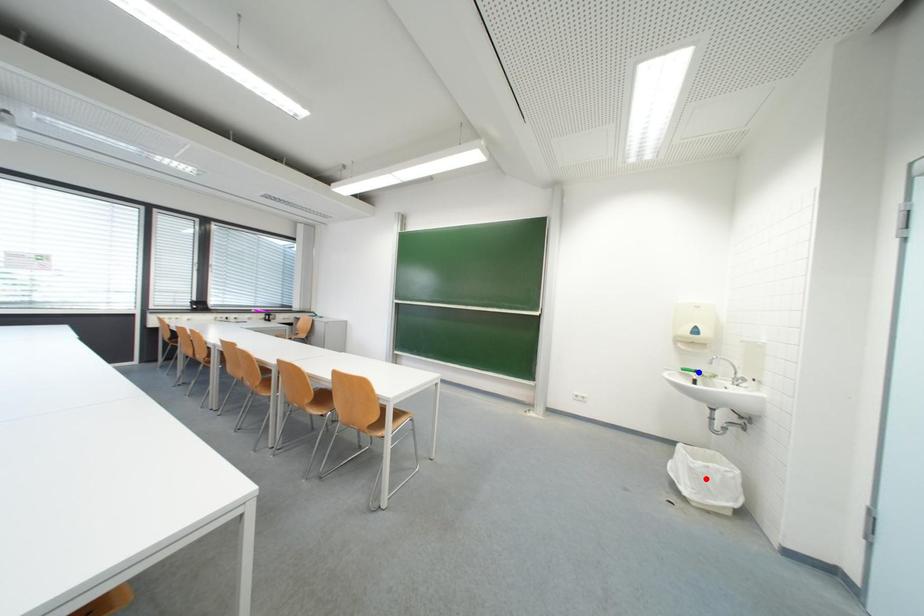
Question: Two points are marked on the image. Which point is closer to the camera?

Choices:
 (A) Blue point is closer.
 (B) Red point is closer.

Answer: (B)